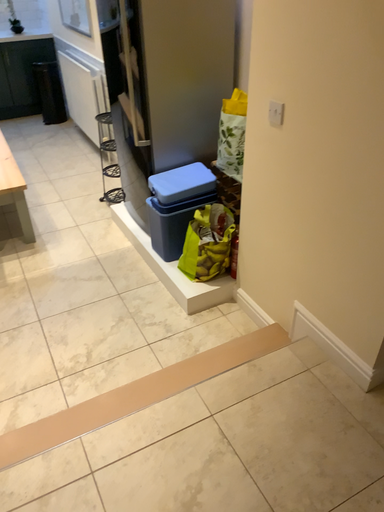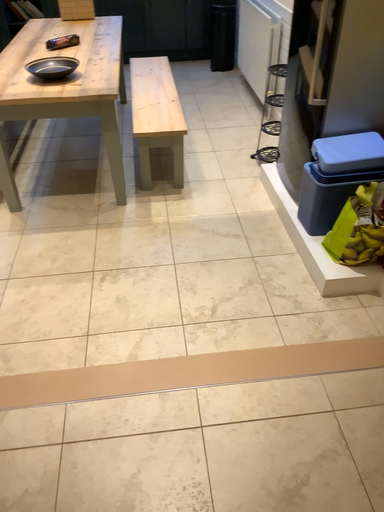
Question: Which way did the camera rotate in the video?

Choices:
 (A) rotated right
 (B) rotated left

Answer: (B)